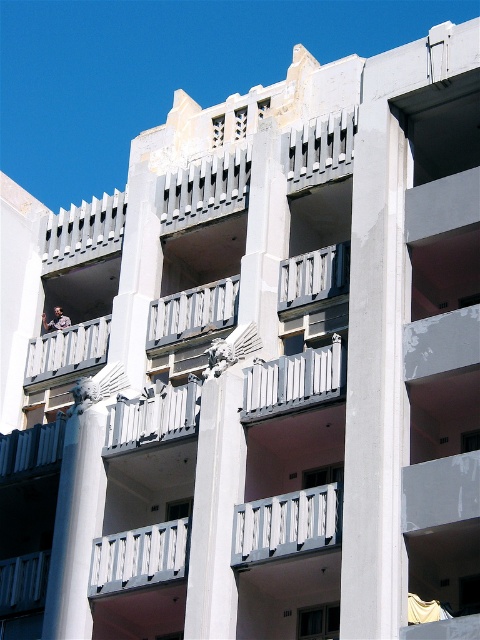
Question: Is white painted wood at center below white painted metal balustrade at center?

Choices:
 (A) yes
 (B) no

Answer: (A)

Question: Which point is closer to the camera?

Choices:
 (A) (256, 554)
 (B) (365, 369)
 (C) (248, 387)

Answer: (B)

Question: Can you confirm if white painted metal balustrade at center is positioned above light brown wooden figure at upper left?

Choices:
 (A) no
 (B) yes

Answer: (A)

Question: From the image, what is the correct spatial relationship of white matte balustrade at center in relation to light brown wooden figure at upper left?

Choices:
 (A) below
 (B) above

Answer: (A)

Question: Which object appears farthest from the camera in this image?

Choices:
 (A) white smooth column at center
 (B) white marble column at center

Answer: (B)

Question: Considering the real-world distances, which object is closest to the light brown wooden figure at upper left?

Choices:
 (A) white concrete pillar at center
 (B) white marble column at center
 (C) white smooth column at center

Answer: (B)